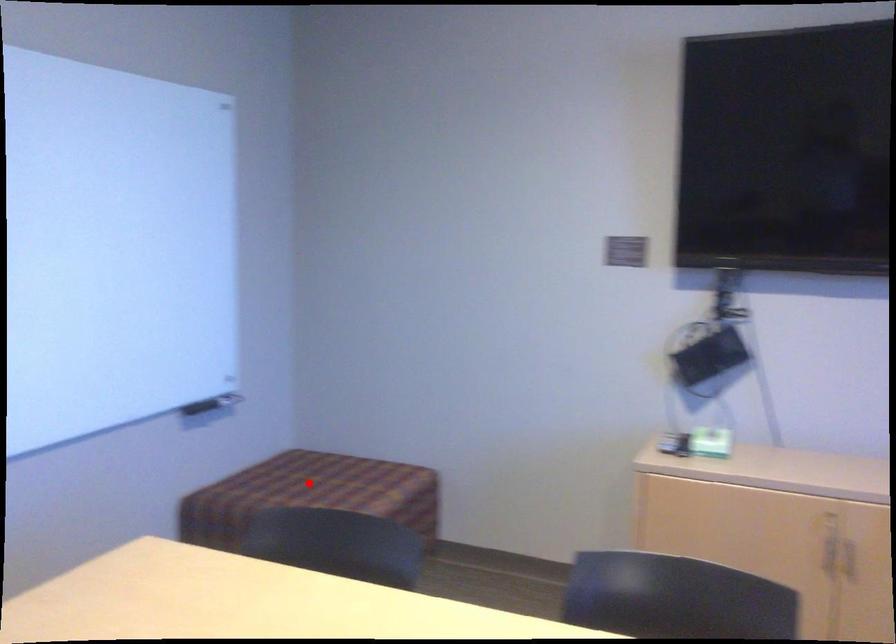
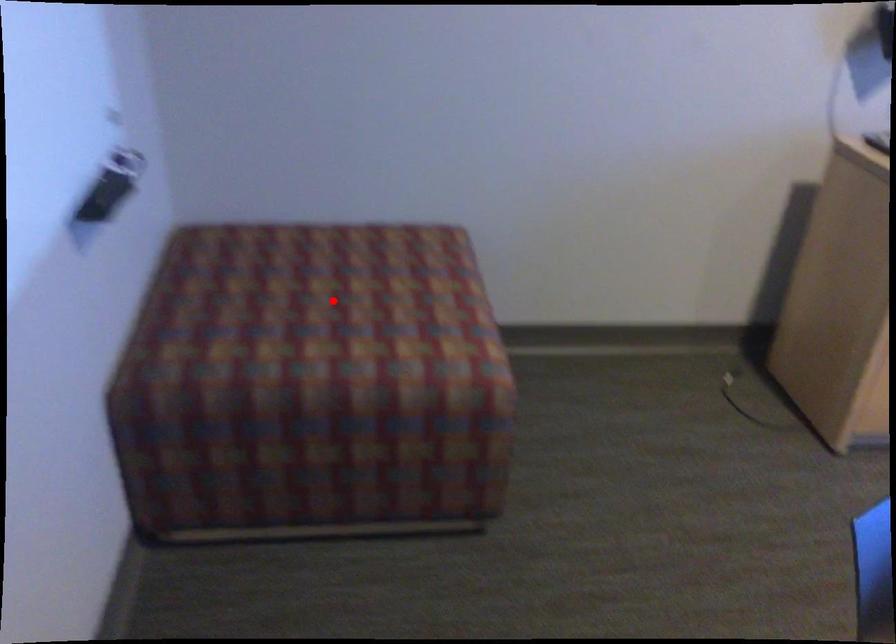
I am providing you with two images of the same scene from different viewpoints. A red point is marked on the first image and another point is marked on the second image. Is the marked point in image1 the same physical position as the marked point in image2?

Yes